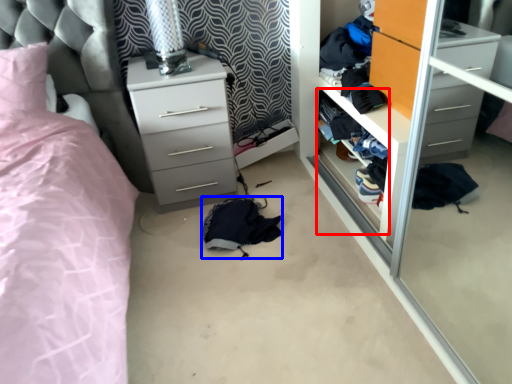
Question: Which of the following is the closest to the observer, shelf (highlighted by a red box) or clothing (highlighted by a blue box)?

Choices:
 (A) shelf
 (B) clothing

Answer: (A)